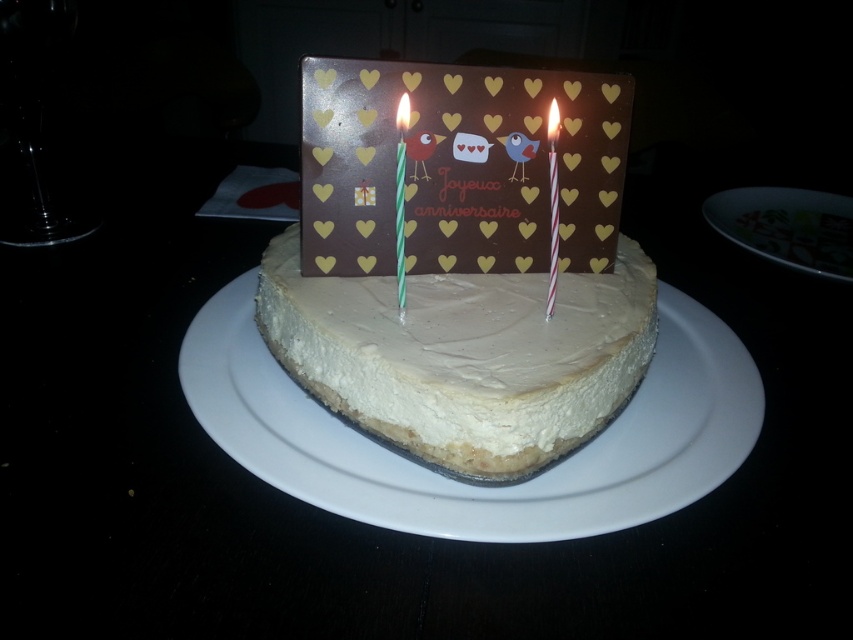
You are a birthday celebrant who wants to blow out the candles on the white cream cheese cake at center. You need to place your mouth exactly at point point (462, 262) to blow out the candles. Is this point on the cake?

Yes, the point (462, 262) is on the white cream cheese cake at center, so you can place your mouth there to blow out the candles.

You are at a birthday party and need to place a candle on the cake. The candle is currently on the white glossy plate at upper right. Can you move it to the white cream cheese cake at center without touching the plate?

The white cream cheese cake at center is to the left of the white glossy plate at upper right, so you can move the candle from the plate to the cake by moving it to the left side of the plate.